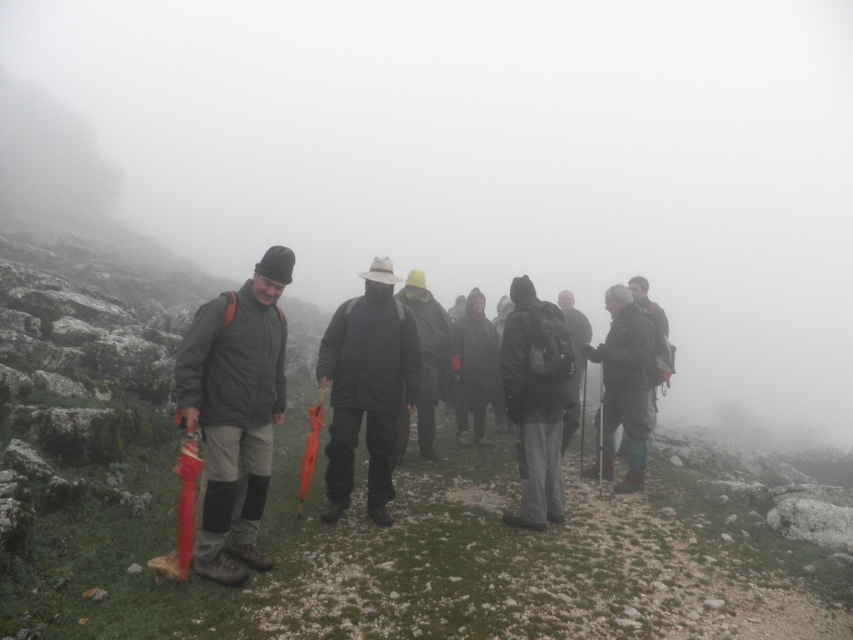
You are a photographer trying to capture a group photo of the dark gray fabric jacket at center and the matte black jacket at center. Since the jackets are the same color tone, you want to ensure they are distinguishable in the photo. Which jacket should you focus on to highlight its size difference?

The dark gray fabric jacket at center is smaller compared to the matte black jacket at center, so focusing on the dark gray fabric jacket at center will highlight its smaller size.

You are a hiker trying to decide which jacket to wear for the misty hike. You see the black matte jacket at center and the dark gray fabric jacket at center. Which jacket has a larger size?

The black matte jacket at center is bigger than the dark gray fabric jacket at center, so the black matte jacket at center has a larger size.

You are a photographer trying to capture a clear shot of the dark gray woolen hat at center and the matte gray jacket at left. Since the scene is foggy, you want to adjust your camera to focus on the taller object. Which object should you focus on?

The dark gray woolen hat at center is taller than the matte gray jacket at left, so you should focus on the dark gray woolen hat at center.